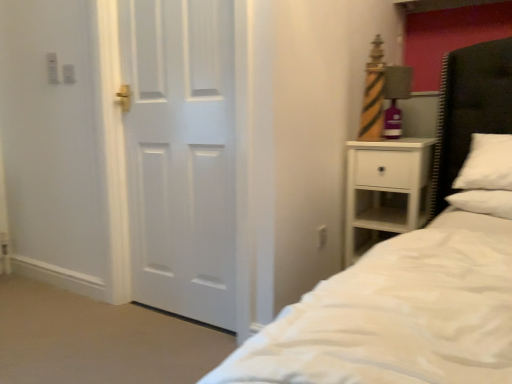
Find the location of a particular element. This screenshot has height=384, width=512. free spot in front of white glossy door at left is located at coordinates (144, 349).